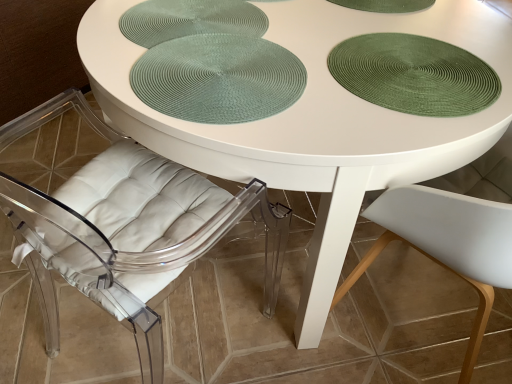
Locate an element on the screen. This screenshot has height=384, width=512. blank area beneath transparent acrylic chair at lower left (from a real-world perspective) is located at coordinates (136, 348).